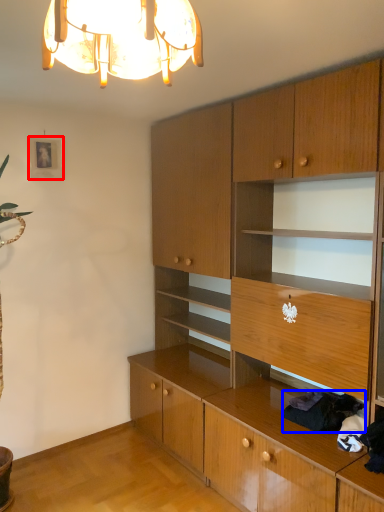
Question: Which point is closer to the camera, picture frame (highlighted by a red box) or clothing (highlighted by a blue box)?

Choices:
 (A) picture frame
 (B) clothing

Answer: (B)